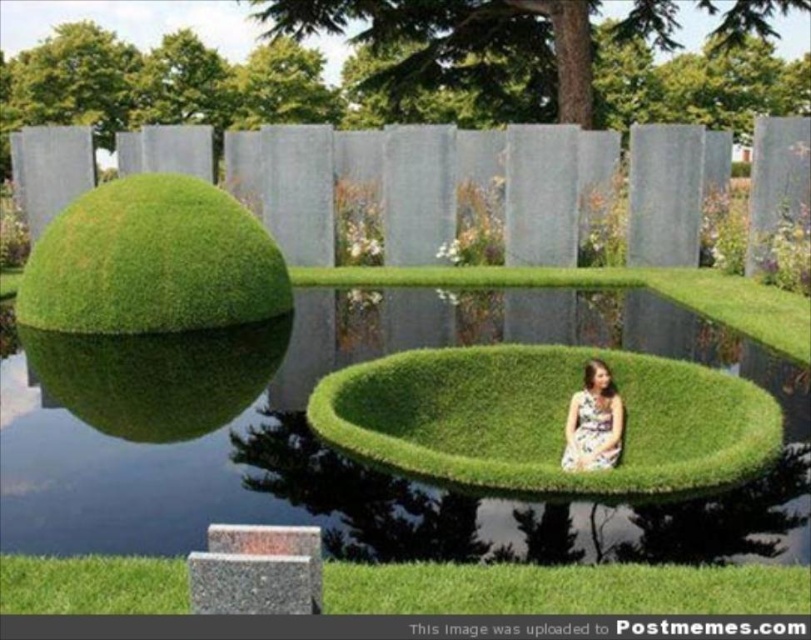
Is the position of green grassy bowl at center less distant than that of floral dress at center?

No, it is behind floral dress at center.

Which of these two, green grassy bowl at center or floral dress at center, stands shorter?

green grassy bowl at center is shorter.

Locate an element on the screen. The image size is (811, 640). green grassy bowl at center is located at coordinates (341, 454).

Who is positioned more to the left, green grassy bowl at center or green grassy sphere at left?

green grassy sphere at left

Which is in front, point (421, 534) or point (114, 216)?

Point (421, 534) is more forward.

Describe the element at coordinates (341, 454) in the screenshot. I see `green grassy bowl at center` at that location.

Find the location of `green grassy bowl at center`. green grassy bowl at center is located at coordinates (341, 454).

Between green grassy sphere at left and floral dress at center, which one appears on the right side from the viewer's perspective?

From the viewer's perspective, floral dress at center appears more on the right side.

Image resolution: width=811 pixels, height=640 pixels. I want to click on green grassy sphere at left, so click(x=152, y=260).